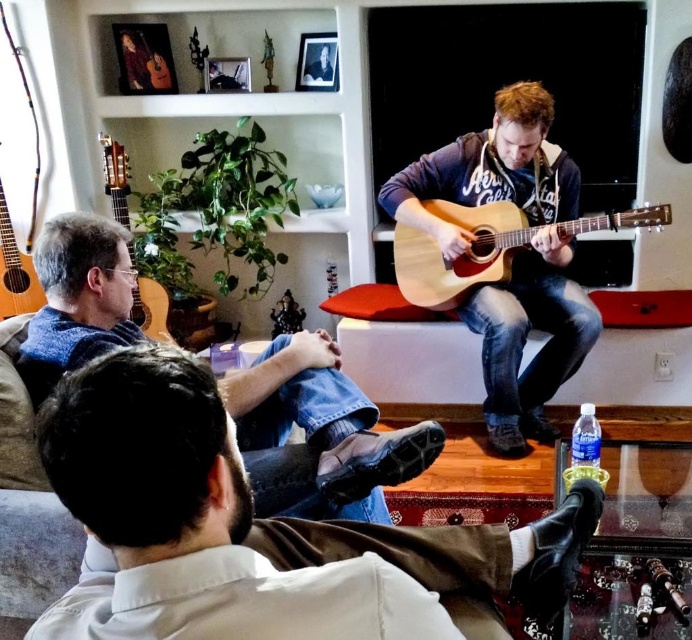
You are standing in the room and want to place a small plant between the two points labeled as point (336, 513) and point (24, 307). Since the plant needs to be closer to the camera, which point should you choose?

Point (336, 513) is closer to the camera than point (24, 307), so you should place the plant near point (336, 513) to ensure it is closer to the camera.

You are a photographer standing at the camera position. You want to take a closeup shot of the light brown wood guitar at left. Can you reach it without moving from your current position if your longest arm extension is 2.7 meters?

The light brown wood guitar at left is 8.93 feet away from camera. Since 8.93 feet is approximately 2.72 meters, and your arm extension is 2.7 meters, you cannot reach it without moving.